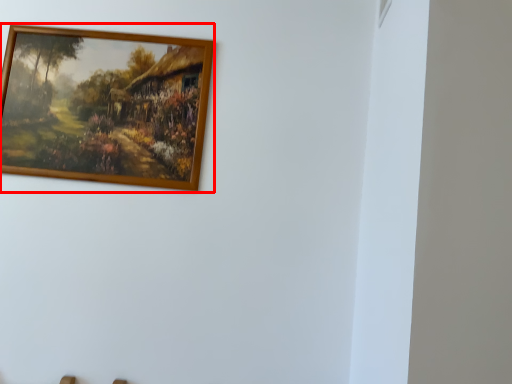
Question: In this image, where is picture frame (annotated by the red box) located relative to window?

Choices:
 (A) left
 (B) right

Answer: (A)